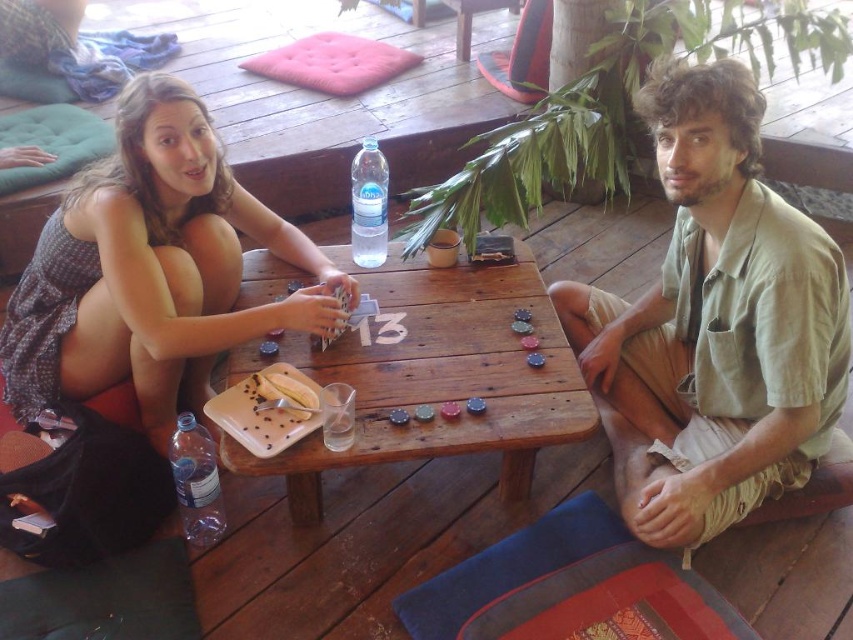
Who is positioned more to the right, matte black dress at upper left or transparent plastic bottle at lower left?

transparent plastic bottle at lower left is more to the right.

Can you confirm if matte black dress at upper left is positioned below transparent plastic bottle at lower left?

No, matte black dress at upper left is not below transparent plastic bottle at lower left.

Between point (207, 122) and point (202, 493), which one is positioned in front?

Point (207, 122) is more forward.

In order to click on matte black dress at upper left in this screenshot , I will do `click(151, 269)`.

Does green cotton shirt at upper right have a larger size compared to transparent plastic water bottle at center?

Yes.

Is point (795, 352) less distant than point (369, 182)?

Yes, it is in front of point (369, 182).

At what (x,y) coordinates should I click in order to perform the action: click on green cotton shirt at upper right. Please return your answer as a coordinate pair (x, y). Looking at the image, I should click on (714, 323).

Looking at this image, is green cotton shirt at upper right further to camera compared to wooden table at center?

No.

Can you confirm if green cotton shirt at upper right is positioned above wooden table at center?

Indeed, green cotton shirt at upper right is positioned over wooden table at center.

The height and width of the screenshot is (640, 853). What are the coordinates of `green cotton shirt at upper right` in the screenshot? It's located at (714, 323).